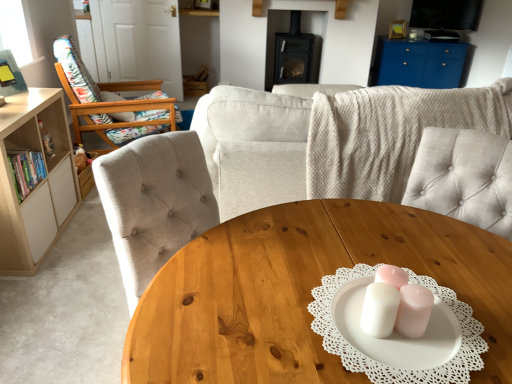
Describe the element at coordinates (445, 14) in the screenshot. The width and height of the screenshot is (512, 384). I see `flat screen tv at upper right` at that location.

This screenshot has width=512, height=384. What do you see at coordinates (111, 102) in the screenshot?
I see `wooden floral-patterned chair at left` at bounding box center [111, 102].

I want to click on black matte fireplace at center, so click(x=294, y=47).

Which object is closer to the camera, wooden coffee table at center or wooden floral-patterned chair at left?

wooden coffee table at center is closer to the camera.

How different are the orientations of wooden coffee table at center and wooden floral-patterned chair at left in degrees?

There is a 68.7-degree angle between the facing directions of wooden coffee table at center and wooden floral-patterned chair at left.

Is wooden floral-patterned chair at left located within wooden coffee table at center?

Actually, wooden floral-patterned chair at left is outside wooden coffee table at center.

From a real-world perspective, which is physically above, wooden coffee table at center or wooden floral-patterned chair at left?

From a 3D spatial view, wooden floral-patterned chair at left is above.

From a real-world perspective, is black matte fireplace at center positioned above or below beige fabric couch at center?

From a real-world perspective, black matte fireplace at center is physically below beige fabric couch at center.

Which of these two, black matte fireplace at center or beige fabric couch at center, is smaller?

black matte fireplace at center is smaller.

This screenshot has width=512, height=384. In order to click on studio couch that appears below the black matte fireplace at center (from the image's perspective) in this screenshot , I will do `click(329, 140)`.

Considering the positions of points (274, 32) and (314, 175), is point (274, 32) farther from camera compared to point (314, 175)?

Yes, point (274, 32) is farther from viewer.

From the image's perspective, is light beige wood bookshelf at left over wooden floral-patterned chair at left?

Incorrect, from the image's perspective, light beige wood bookshelf at left is lower than wooden floral-patterned chair at left.

Which is correct: light beige wood bookshelf at left is inside wooden floral-patterned chair at left, or outside of it?

light beige wood bookshelf at left exists outside the volume of wooden floral-patterned chair at left.

Consider the image. Could you tell me if light beige wood bookshelf at left is facing wooden floral-patterned chair at left?

No, light beige wood bookshelf at left is not aimed at wooden floral-patterned chair at left.

Is point (170, 102) positioned after point (467, 18)?

No, it is not.

This screenshot has height=384, width=512. Identify the location of television above the wooden floral-patterned chair at left (from the image's perspective). (445, 14).

Which of these two, wooden floral-patterned chair at left or flat screen tv at upper right, is thinner?

flat screen tv at upper right is thinner.

Can you confirm if blue glossy cabinet at upper right is thinner than light beige wood bookshelf at left?

Incorrect, the width of blue glossy cabinet at upper right is not less than that of light beige wood bookshelf at left.

Can you confirm if blue glossy cabinet at upper right is positioned to the left of light beige wood bookshelf at left?

Incorrect, blue glossy cabinet at upper right is not on the left side of light beige wood bookshelf at left.

In terms of height, does blue glossy cabinet at upper right look taller or shorter compared to light beige wood bookshelf at left?

In the image, blue glossy cabinet at upper right appears to be shorter than light beige wood bookshelf at left.

Would you consider wooden floral-patterned chair at left to be distant from black matte fireplace at center?

wooden floral-patterned chair at left is positioned a significant distance from black matte fireplace at center.

Is wooden floral-patterned chair at left spatially inside black matte fireplace at center, or outside of it?

wooden floral-patterned chair at left is not inside black matte fireplace at center, it's outside.

From the image's perspective, is wooden floral-patterned chair at left positioned above or below black matte fireplace at center?

Clearly, from the image's perspective, wooden floral-patterned chair at left is below black matte fireplace at center.

Considering their positions, is wooden floral-patterned chair at left located in front of or behind black matte fireplace at center?

Clearly, wooden floral-patterned chair at left is in front of black matte fireplace at center.

Based on their sizes in the image, would you say light beige wood bookshelf at left is bigger or smaller than flat screen tv at upper right?

In the image, light beige wood bookshelf at left appears to be larger than flat screen tv at upper right.

What's the angular difference between light beige wood bookshelf at left and flat screen tv at upper right's facing directions?

The angular difference between light beige wood bookshelf at left and flat screen tv at upper right is 107 degrees.

Considering the sizes of objects light beige wood bookshelf at left and flat screen tv at upper right in the image provided, who is wider, light beige wood bookshelf at left or flat screen tv at upper right?

light beige wood bookshelf at left.

Would you say flat screen tv at upper right is part of light beige wood bookshelf at left's contents?

No, flat screen tv at upper right is not a part of light beige wood bookshelf at left.

Identify the location of chair above the wooden coffee table at center (from the image's perspective). Image resolution: width=512 pixels, height=384 pixels. (111, 102).

The image size is (512, 384). In order to click on studio couch lying in front of the black matte fireplace at center in this screenshot , I will do `click(329, 140)`.

Looking at the image, which one is located further to blue glossy cabinet at upper right, flat screen tv at upper right or wooden coffee table at center?

The object further to blue glossy cabinet at upper right is wooden coffee table at center.

Estimate the real-world distances between objects in this image. Which object is closer to blue glossy cabinet at upper right, beige fabric couch at center or flat screen tv at upper right?

Among the two, flat screen tv at upper right is located nearer to blue glossy cabinet at upper right.

From the image, which object appears to be nearer to blue glossy cabinet at upper right, wooden floral-patterned chair at left or light beige wood bookshelf at left?

The object closer to blue glossy cabinet at upper right is wooden floral-patterned chair at left.

Which object lies nearer to the anchor point beige fabric couch at center, black matte fireplace at center or blue glossy cabinet at upper right?

black matte fireplace at center.

Estimate the real-world distances between objects in this image. Which object is closer to blue glossy cabinet at upper right, flat screen tv at upper right or light beige wood bookshelf at left?

flat screen tv at upper right.

When comparing their distances from wooden floral-patterned chair at left, does flat screen tv at upper right or beige fabric couch at center seem closer?

beige fabric couch at center lies closer to wooden floral-patterned chair at left than the other object.

Which object lies nearer to the anchor point light beige wood bookshelf at left, wooden floral-patterned chair at left or black matte fireplace at center?

Based on the image, wooden floral-patterned chair at left appears to be nearer to light beige wood bookshelf at left.

Considering their positions, is wooden coffee table at center positioned further to beige fabric couch at center than blue glossy cabinet at upper right?

blue glossy cabinet at upper right lies further to beige fabric couch at center than the other object.

What are the coordinates of `studio couch located between wooden coffee table at center and wooden floral-patterned chair at left in the depth direction` in the screenshot? It's located at (329, 140).

You are a GUI agent. You are given a task and a screenshot of the screen. Output one action in this format:
    pyautogui.click(x=<x>, y=<y>)
    Task: Click on the chair between beige fabric couch at center and blue glossy cabinet at upper right in the front-back direction
    This screenshot has width=512, height=384.
    Given the screenshot: What is the action you would take?
    pyautogui.click(x=111, y=102)

Locate an element on the screen. chair between light beige wood bookshelf at left and flat screen tv at upper right is located at coordinates (111, 102).

The image size is (512, 384). I want to click on fireplace between wooden coffee table at center and blue glossy cabinet at upper right along the z-axis, so click(294, 47).